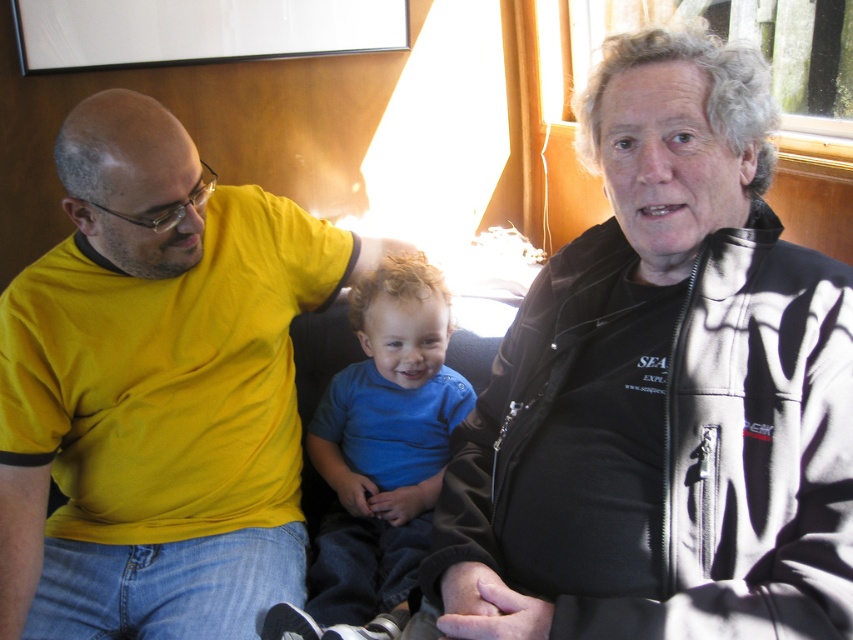
Question: From the image, what is the correct spatial relationship of yellow t-shirt at left in relation to blue smooth shirt at center?

Choices:
 (A) left
 (B) right

Answer: (A)

Question: Based on their relative distances, which object is nearer to the black softshell jacket at upper right?

Choices:
 (A) yellow t-shirt at left
 (B) blue smooth shirt at center

Answer: (B)

Question: Is black softshell jacket at upper right to the right of yellow t-shirt at left from the viewer's perspective?

Choices:
 (A) no
 (B) yes

Answer: (B)

Question: Estimate the real-world distances between objects in this image. Which object is farther from the blue smooth shirt at center?

Choices:
 (A) yellow t-shirt at left
 (B) black softshell jacket at upper right

Answer: (B)

Question: Does yellow t-shirt at left appear over blue smooth shirt at center?

Choices:
 (A) yes
 (B) no

Answer: (A)

Question: Which of the following is the closest to the observer?

Choices:
 (A) (840, 520)
 (B) (300, 308)

Answer: (A)